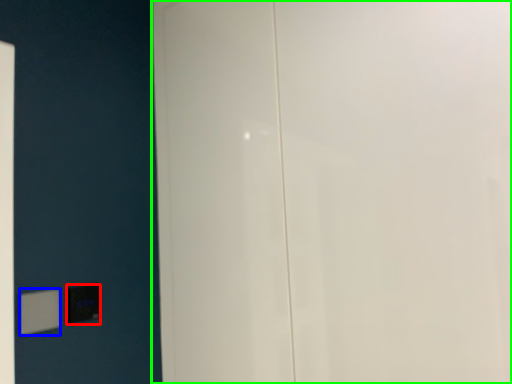
Question: Which is farther away from light switch (highlighted by a red box)? light switch (highlighted by a blue box) or door (highlighted by a green box)?

Choices:
 (A) light switch
 (B) door

Answer: (B)